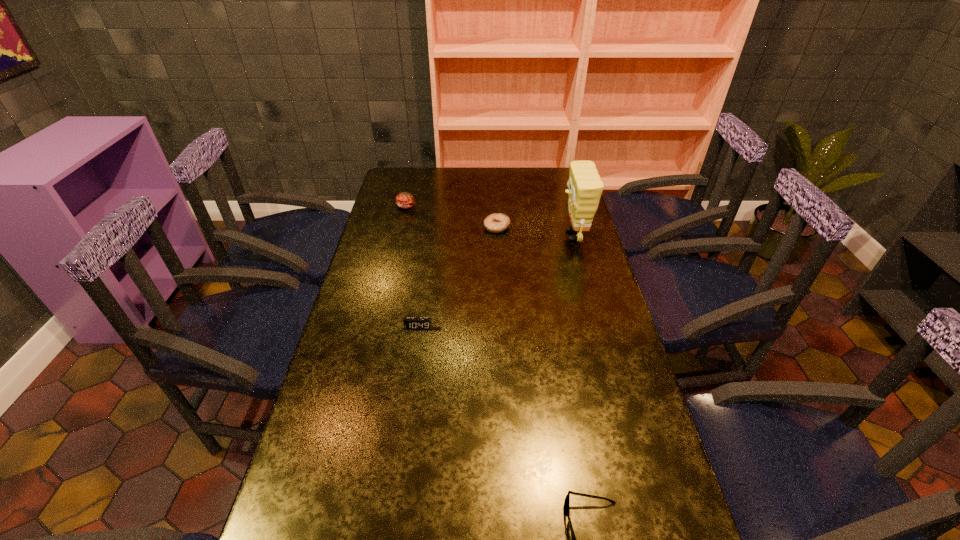
Identify the location of the rightmost object. (585, 187).

Where is `sponge`? This screenshot has height=540, width=960. sponge is located at coordinates (585, 187).

This screenshot has height=540, width=960. What are the coordinates of `the leftmost object` in the screenshot? It's located at (405, 200).

Locate an element on the screen. This screenshot has height=540, width=960. the fourth shortest object is located at coordinates (405, 200).

Find the location of a particular element. The image size is (960, 540). doughnut is located at coordinates (497, 222).

You are a GUI agent. You are given a task and a screenshot of the screen. Output one action in this format:
    pyautogui.click(x=<x>, y=<y>)
    Task: Click on the second object from left to right
    The image size is (960, 540).
    Given the screenshot: What is the action you would take?
    pyautogui.click(x=410, y=323)

Locate an element on the screen. This screenshot has width=960, height=540. the second nearest object is located at coordinates (410, 323).

Locate an element on the screen. This screenshot has height=540, width=960. vacant space positioned on the face of the rightmost object is located at coordinates (543, 235).

Locate an element on the screen. blank space located on the face of the rightmost object is located at coordinates (543, 235).

This screenshot has height=540, width=960. In order to click on vacant space located 0.350m on the face of the rightmost object in this screenshot , I will do `click(467, 235)`.